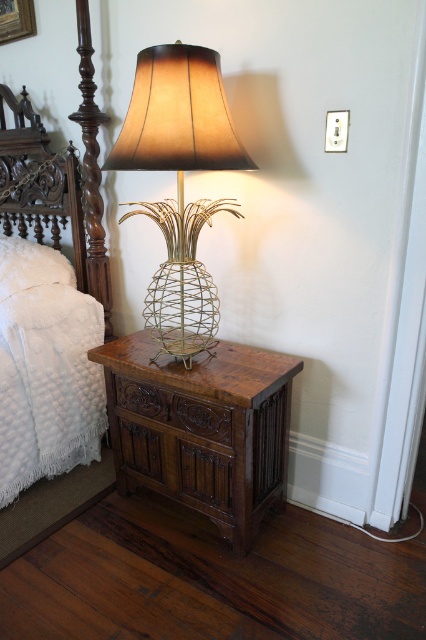
You are a delivery person placing a package on the brown wood side table at lower center. The package is 24 inches wide. Will the package fit on the table without hanging over the edge near the white quilted fabric at left?

The brown wood side table at lower center is 23.07 inches from the white quilted fabric at left. Since the package is 24 inches wide, it will hang over the edge near the white quilted fabric at left by approximately 0.93 inches.

You are trying to place a small decorative item on the brown wood side table at lower center. However, there is a white quilted fabric at left nearby. Based on their heights, which object should you place the item on to ensure it is visible from above?

The brown wood side table at lower center is not as tall as the white quilted fabric at left, so placing the item on the brown wood side table at lower center will make it more visible from above since it is shorter than the white quilted fabric at left.

Looking at this image, you are sitting on the bed and want to grab the white fluffy pillow at upper left. The gold wire pineapple lamp at center is in your way. Can you reach the pillow without moving the lamp?

The gold wire pineapple lamp at center is closer to the viewer than the white fluffy pillow at upper left, so you would need to move the lamp to reach the pillow.